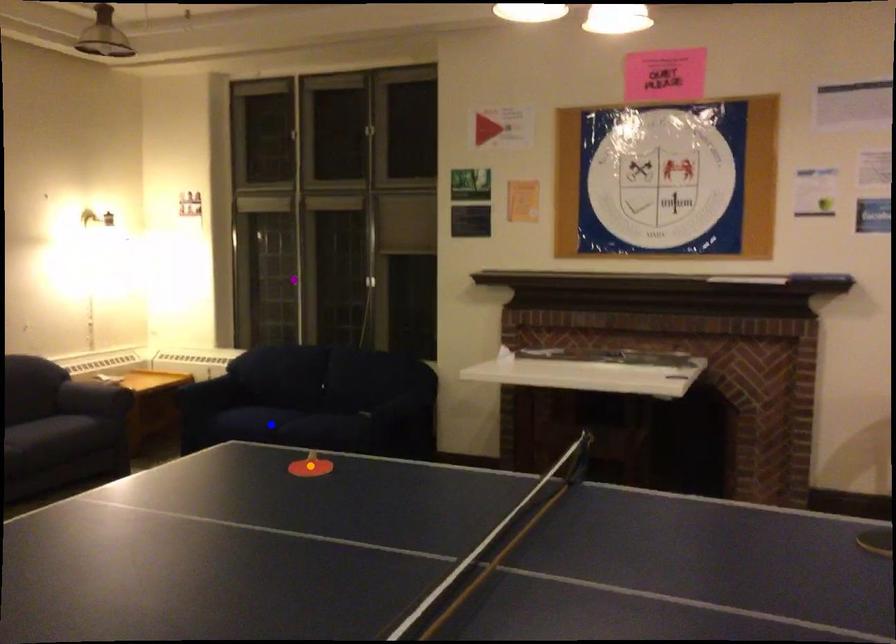
Order these from nearest to farthest:
blue point, orange point, purple point

purple point → blue point → orange point